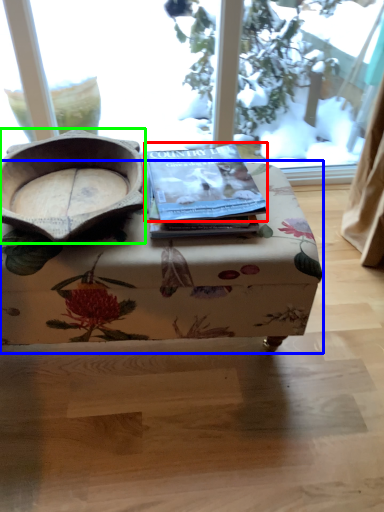
Question: Which is farther away from paperback book (highlighted by a red box)? table (highlighted by a blue box) or bowl (highlighted by a green box)?

Choices:
 (A) table
 (B) bowl

Answer: (B)